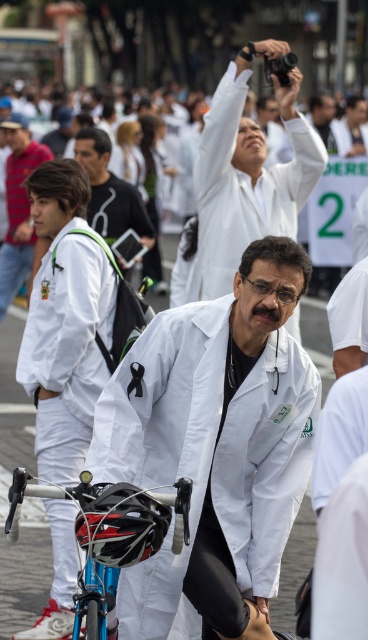
Is point (287, 339) positioned before point (27, 340)?

That is True.

Can you confirm if white matte lab coat at center is shorter than white matte jacket at left?

Yes.

I want to click on white matte lab coat at center, so click(214, 449).

Does white lab coat at upper center appear on the left side of matte white lab coat at left?

No, white lab coat at upper center is not to the left of matte white lab coat at left.

Does white lab coat at upper center appear over matte white lab coat at left?

Incorrect, white lab coat at upper center is not positioned above matte white lab coat at left.

Is point (242, 154) closer to viewer compared to point (5, 275)?

Yes, point (242, 154) is closer to viewer.

You are a GUI agent. You are given a task and a screenshot of the screen. Output one action in this format:
    pyautogui.click(x=<x>, y=<y>)
    Task: Click on the white lab coat at upper center
    
    Given the screenshot: What is the action you would take?
    pyautogui.click(x=248, y=173)

Does black matte bicycle helmet at center have a lesser height compared to matte white lab coat at left?

No, black matte bicycle helmet at center is not shorter than matte white lab coat at left.

The width and height of the screenshot is (368, 640). Describe the element at coordinates (119, 522) in the screenshot. I see `black matte bicycle helmet at center` at that location.

You are a GUI agent. You are given a task and a screenshot of the screen. Output one action in this format:
    pyautogui.click(x=<x>, y=<y>)
    Task: Click on the black matte bicycle helmet at center
    This screenshot has height=640, width=368.
    Given the screenshot: What is the action you would take?
    pyautogui.click(x=119, y=522)